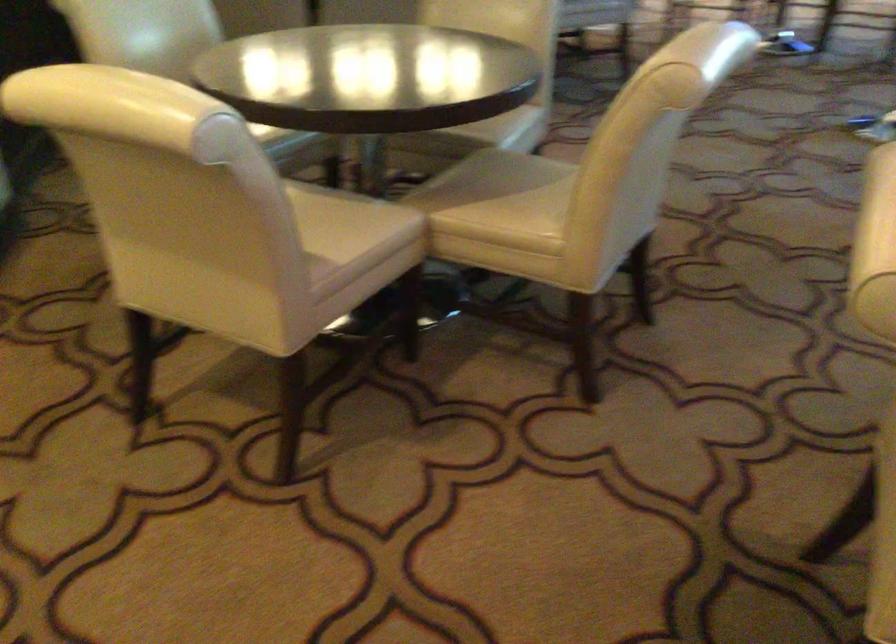
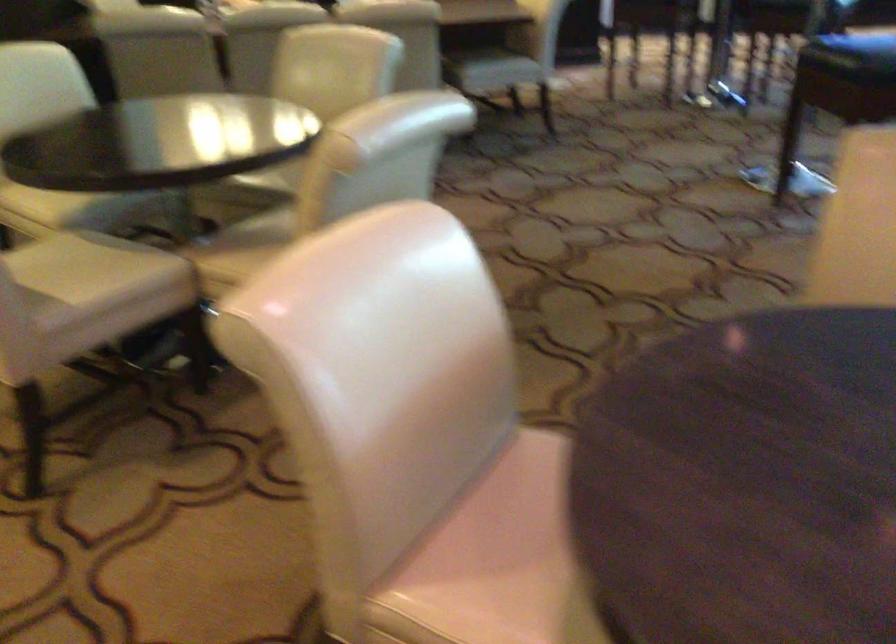
Where in the second image is the point corresponding to pixel 308 220 from the first image?

(82, 266)